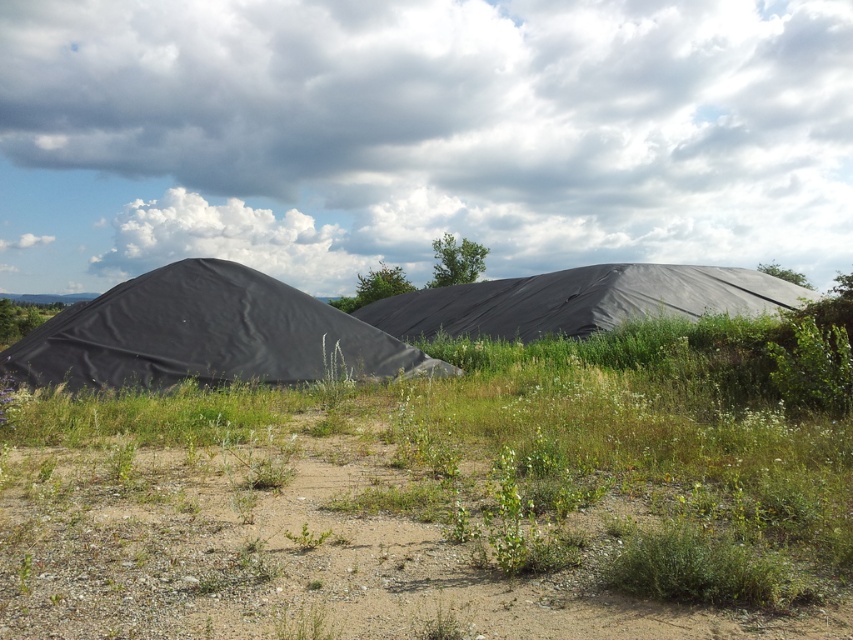
You are standing at the center of the image and want to walk to the black matte tent at left. Which direction should you face to head towards it?

You should face towards the left direction to head towards the black matte tent at left since it is located at the left side of the image.

You are a park ranger inspecting an outdoor area. You notice a black matte tent at left and a black tarp at center. Which object is taller when viewed from above?

The black tarp at center is taller than the black matte tent at left.

You are a photographer standing in the foreground of this outdoor scene. You want to take a photo that includes both the black matte tent at left and the black tarp at center. Which object should you position closer to the front of your photo to ensure both are visible?

You should position the black matte tent at left closer to the front of your photo because it is already closer to the viewer than the black tarp at center, ensuring both objects are visible in the frame.